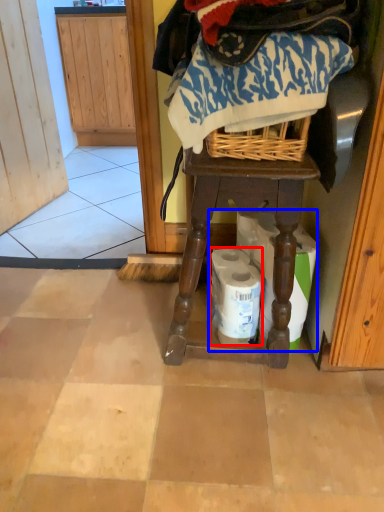
Question: Which point is further to the camera, toilet paper (highlighted by a red box) or toilet paper (highlighted by a blue box)?

Choices:
 (A) toilet paper
 (B) toilet paper

Answer: (A)